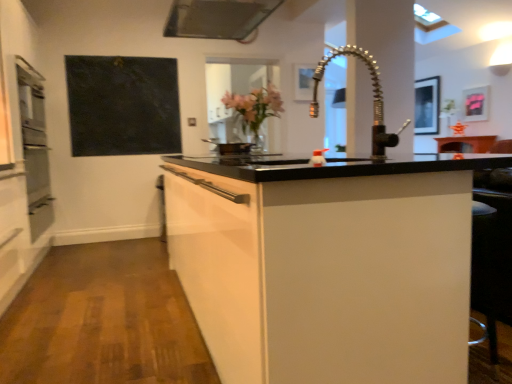
Question: Which direction should I rotate to look at metallic silver picture frame at upper center, marked as the third picture frame in a back-to-front arrangement, — up or down?

Choices:
 (A) down
 (B) up

Answer: (B)

Question: Is metallic silver picture frame at upper right, which is counted as the first picture frame, starting from the right, with metallic silver picture frame at upper center, arranged as the first picture frame when viewed from the front?

Choices:
 (A) yes
 (B) no

Answer: (B)

Question: Considering the relative sizes of metallic silver picture frame at upper right, which is counted as the first picture frame, starting from the right, and metallic silver picture frame at upper center, marked as the first picture frame in a left-to-right arrangement, in the image provided, is metallic silver picture frame at upper right, which is counted as the first picture frame, starting from the right, bigger than metallic silver picture frame at upper center, marked as the first picture frame in a left-to-right arrangement,?

Choices:
 (A) yes
 (B) no

Answer: (A)

Question: Is metallic silver picture frame at upper right, the third picture frame positioned from the left, to the left of metallic silver picture frame at upper center, the third picture frame positioned from the right, from the viewer's perspective?

Choices:
 (A) no
 (B) yes

Answer: (A)

Question: Considering the relative sizes of metallic silver picture frame at upper right, the third picture frame positioned from the left, and metallic silver picture frame at upper center, marked as the third picture frame in a back-to-front arrangement, in the image provided, is metallic silver picture frame at upper right, the third picture frame positioned from the left, wider than metallic silver picture frame at upper center, marked as the third picture frame in a back-to-front arrangement,?

Choices:
 (A) no
 (B) yes

Answer: (A)

Question: Is metallic silver picture frame at upper right, which is the second picture frame in back-to-front order, positioned beyond the bounds of metallic silver picture frame at upper center, the third picture frame positioned from the right?

Choices:
 (A) no
 (B) yes

Answer: (B)

Question: Is metallic silver picture frame at upper right, marked as the 2th picture frame in a front-to-back arrangement, oriented towards metallic silver picture frame at upper center, arranged as the first picture frame when viewed from the front?

Choices:
 (A) yes
 (B) no

Answer: (A)

Question: Is metallic silver exhaust hood at upper center positioned with its back to black matte board at upper left?

Choices:
 (A) yes
 (B) no

Answer: (B)

Question: Does metallic silver exhaust hood at upper center lie behind black matte board at upper left?

Choices:
 (A) yes
 (B) no

Answer: (B)

Question: Does metallic silver exhaust hood at upper center touch black matte board at upper left?

Choices:
 (A) yes
 (B) no

Answer: (B)

Question: Are metallic silver exhaust hood at upper center and black matte board at upper left far apart?

Choices:
 (A) yes
 (B) no

Answer: (A)

Question: Is metallic silver exhaust hood at upper center facing towards black matte board at upper left?

Choices:
 (A) yes
 (B) no

Answer: (B)

Question: Can you confirm if metallic silver exhaust hood at upper center is smaller than black matte board at upper left?

Choices:
 (A) no
 (B) yes

Answer: (A)

Question: Can you confirm if metallic silver picture frame at upper right, which appears as the second picture frame when viewed from the left, is shorter than black matte board at upper left?

Choices:
 (A) yes
 (B) no

Answer: (A)